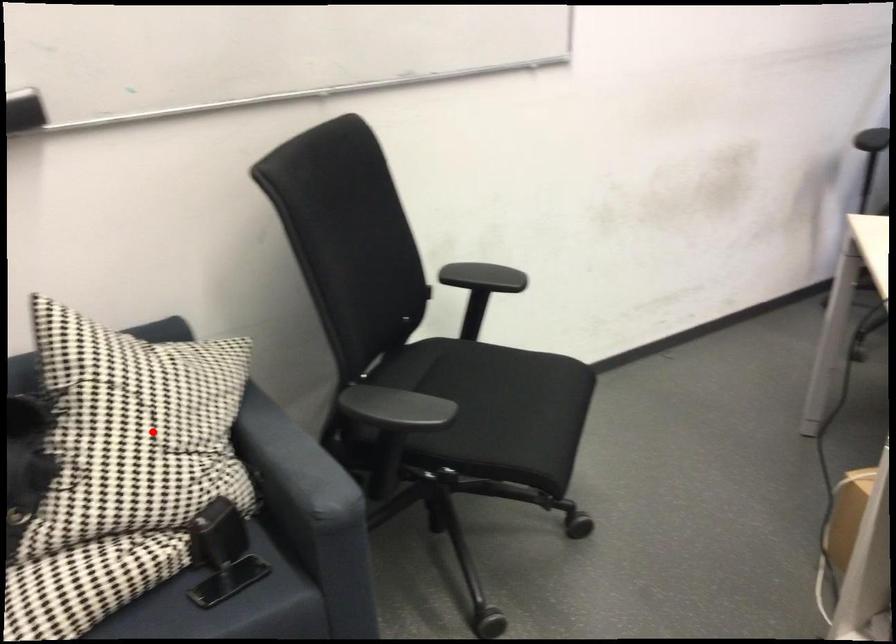
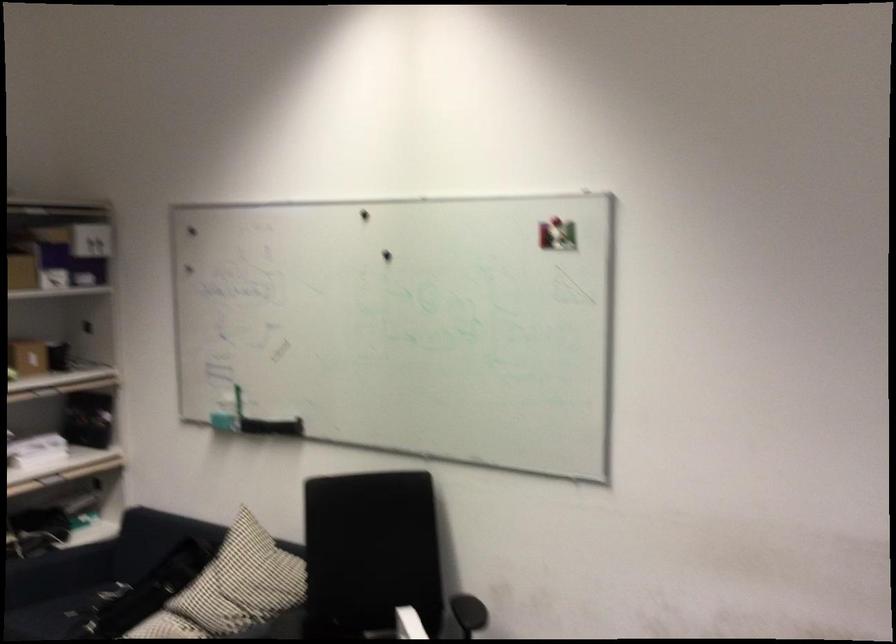
The point at the highlighted location is marked in the first image. Where is the corresponding point in the second image?

(231, 588)